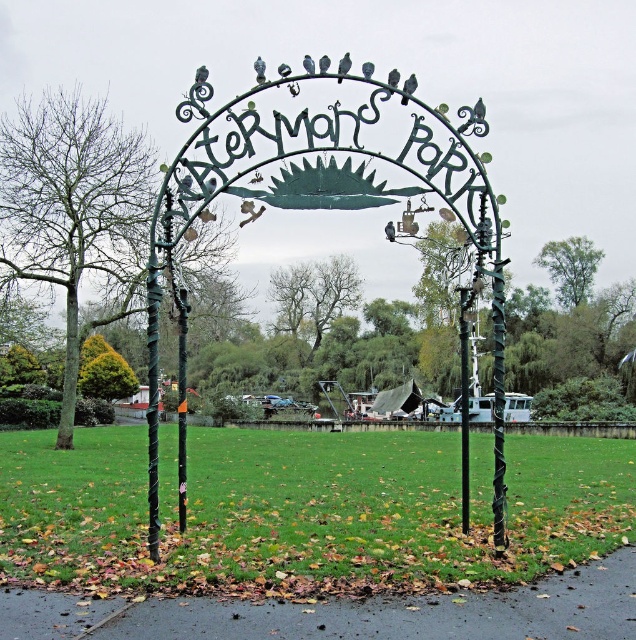
Question: Which object is closer to the camera taking this photo?

Choices:
 (A) gray matte bird at center
 (B) dark gray matte bird at upper center
 (C) gray matte bird at upper center

Answer: (B)

Question: Which is farther from the gray matte bird at center?

Choices:
 (A) green wrought iron pole at center
 (B) dark gray matte bird at upper center
 (C) gray matte bird at upper center

Answer: (A)

Question: Is black metal pole at center smaller than dark gray matte bird at upper center?

Choices:
 (A) yes
 (B) no

Answer: (B)

Question: Which point is farther to the camera?

Choices:
 (A) green wrought iron pole at center
 (B) dark gray matte bird at upper center
 (C) gray matte bird at center
 (D) gray matte bird at upper center

Answer: (D)

Question: Is green wrought iron pole at center wider than gray matte bird at upper center?

Choices:
 (A) yes
 (B) no

Answer: (A)

Question: Is the position of black metal pole at center more distant than that of gray matte bird at upper center?

Choices:
 (A) yes
 (B) no

Answer: (A)